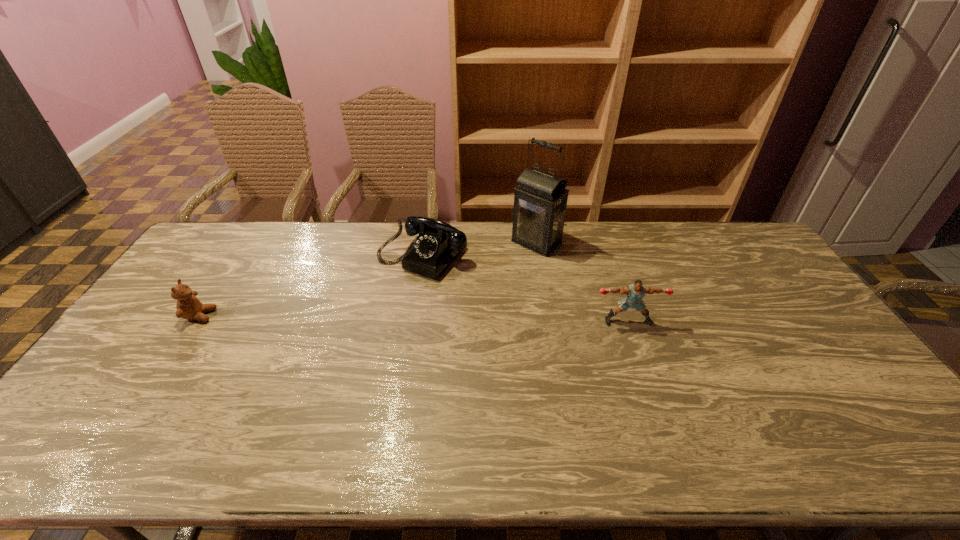
At what (x,y) coordinates should I click in order to perform the action: click on the leftmost object. Please return your answer as a coordinate pair (x, y). Looking at the image, I should click on point(188,306).

Identify the location of the shortest object. This screenshot has width=960, height=540. (188, 306).

Find the location of a particular element. This screenshot has height=540, width=960. puncher is located at coordinates (635, 292).

I want to click on telephone, so click(438, 243).

You are a GUI agent. You are given a task and a screenshot of the screen. Output one action in this format:
    pyautogui.click(x=<x>, y=<y>)
    Task: Click on the lantern
    This screenshot has width=960, height=540.
    Given the screenshot: What is the action you would take?
    pyautogui.click(x=540, y=199)

Where is `the second object from right to left`? The image size is (960, 540). the second object from right to left is located at coordinates (540, 199).

Image resolution: width=960 pixels, height=540 pixels. In order to click on free space located 0.120m on the face of the teddy bear in this screenshot , I will do `click(253, 315)`.

You are a GUI agent. You are given a task and a screenshot of the screen. Output one action in this format:
    pyautogui.click(x=<x>, y=<y>)
    Task: Click on the free space located on the front-facing side of the puncher
    The image size is (960, 540).
    Given the screenshot: What is the action you would take?
    pyautogui.click(x=643, y=368)

I want to click on vacant space located on the dial of the telephone, so click(x=335, y=343).

What are the coordinates of `free region located 0.250m on the dial of the telephone` in the screenshot? It's located at (348, 329).